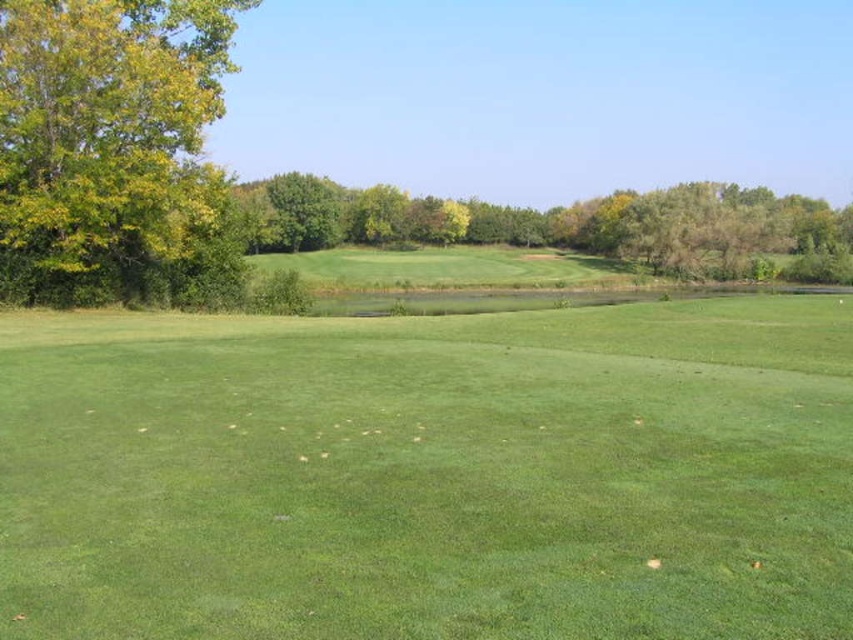
Question: Which object is farther from the camera taking this photo?

Choices:
 (A) green leafy tree at left
 (B) green leafy tree at center

Answer: (B)

Question: Which object is closer to the camera taking this photo?

Choices:
 (A) green leafy trees at center
 (B) green leafy tree at left

Answer: (B)

Question: Does green smooth grass at center appear over green leafy tree at left?

Choices:
 (A) no
 (B) yes

Answer: (A)

Question: Is green smooth grass at center smaller than green leafy tree at left?

Choices:
 (A) yes
 (B) no

Answer: (A)

Question: Can you confirm if green leafy tree at left is positioned to the right of green leafy tree at center?

Choices:
 (A) yes
 (B) no

Answer: (A)

Question: Which of the following is the farthest from the observer?

Choices:
 (A) tap(619, 250)
 (B) tap(88, 241)

Answer: (A)